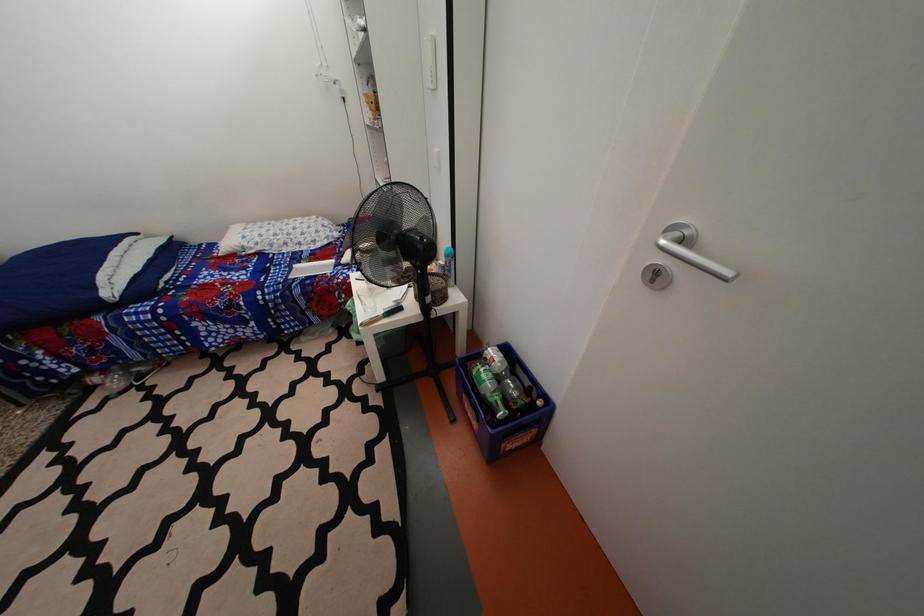
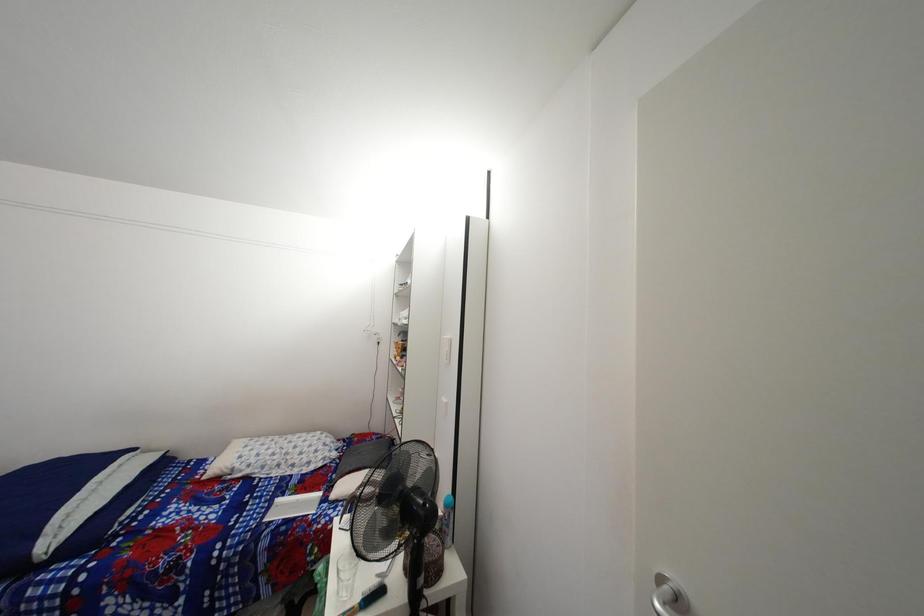
Question: How did the camera likely rotate?

Choices:
 (A) Left
 (B) Right
 (C) Up
 (D) Down

Answer: (C)